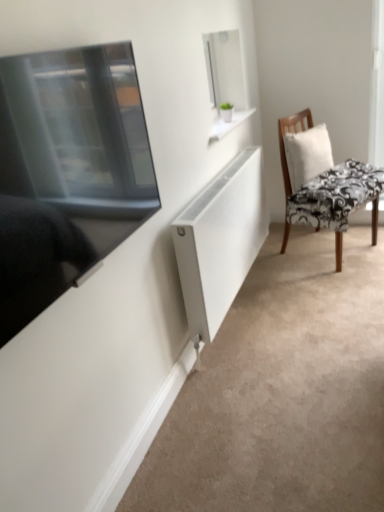
Question: From the image's perspective, does matte black tv at left appear lower than white fabric pillow at right?

Choices:
 (A) no
 (B) yes

Answer: (B)

Question: Considering the relative sizes of matte black tv at left and white fabric pillow at right in the image provided, is matte black tv at left thinner than white fabric pillow at right?

Choices:
 (A) no
 (B) yes

Answer: (B)

Question: Can you confirm if matte black tv at left is positioned to the right of white fabric pillow at right?

Choices:
 (A) yes
 (B) no

Answer: (B)

Question: Is the depth of matte black tv at left greater than that of white fabric pillow at right?

Choices:
 (A) yes
 (B) no

Answer: (B)

Question: Could you tell me if matte black tv at left is facing white fabric pillow at right?

Choices:
 (A) yes
 (B) no

Answer: (B)

Question: Is matte black tv at left not near white fabric pillow at right?

Choices:
 (A) no
 (B) yes

Answer: (B)

Question: From the image's perspective, would you say white fabric pillow at right is shown under white matte radiator at center?

Choices:
 (A) yes
 (B) no

Answer: (B)

Question: Can you confirm if white fabric pillow at right is taller than white matte radiator at center?

Choices:
 (A) no
 (B) yes

Answer: (A)

Question: Does white fabric pillow at right have a lesser width compared to white matte radiator at center?

Choices:
 (A) yes
 (B) no

Answer: (A)

Question: Is the position of white fabric pillow at right more distant than that of white matte radiator at center?

Choices:
 (A) yes
 (B) no

Answer: (A)

Question: Is the position of white fabric pillow at right less distant than that of white matte radiator at center?

Choices:
 (A) yes
 (B) no

Answer: (B)

Question: From a real-world perspective, is white fabric pillow at right positioned under white matte radiator at center based on gravity?

Choices:
 (A) yes
 (B) no

Answer: (B)

Question: Is the depth of black floral fabric chair at right greater than that of matte black tv at left?

Choices:
 (A) no
 (B) yes

Answer: (B)